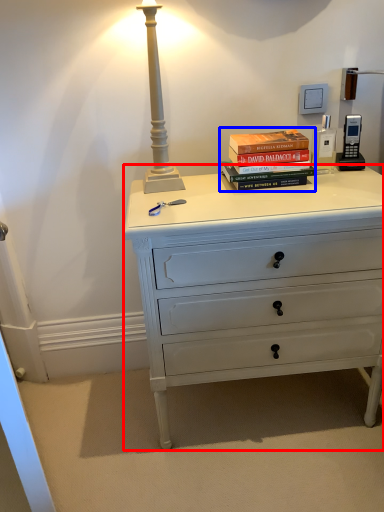
Question: Which object is closer to the camera taking this photo, chest of drawers (highlighted by a red box) or book (highlighted by a blue box)?

Choices:
 (A) chest of drawers
 (B) book

Answer: (A)